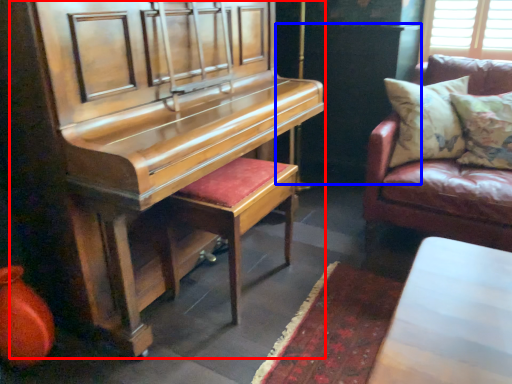
Question: Which of the following is the farthest to the observer, harpsichord (highlighted by a red box) or dark (highlighted by a blue box)?

Choices:
 (A) harpsichord
 (B) dark

Answer: (B)